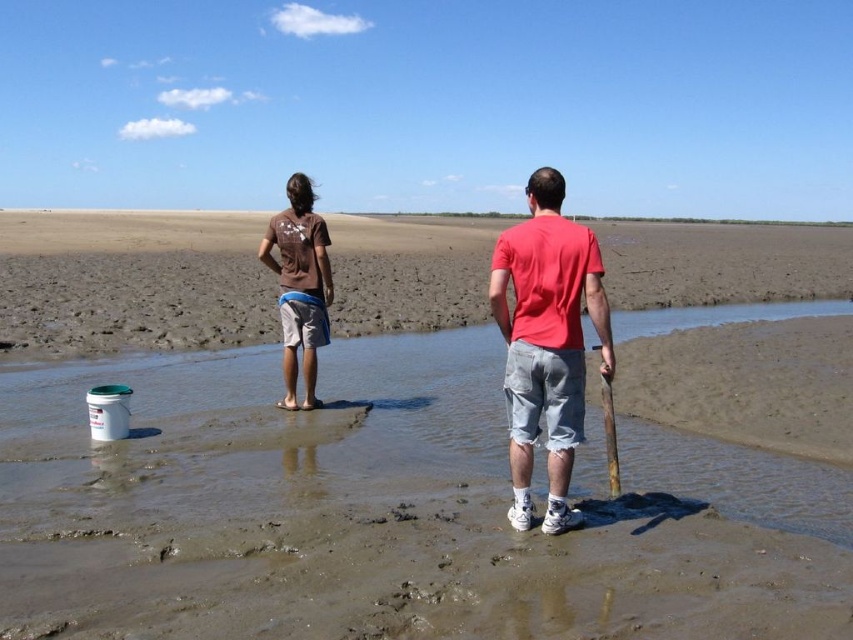
You are a photographer trying to capture a clear shot of both the brown sand at center and the muddy sand at center. Which one will appear larger in your photo due to its position?

The brown sand at center will appear larger in the photo because it is closer to the viewer than the muddy sand at center.